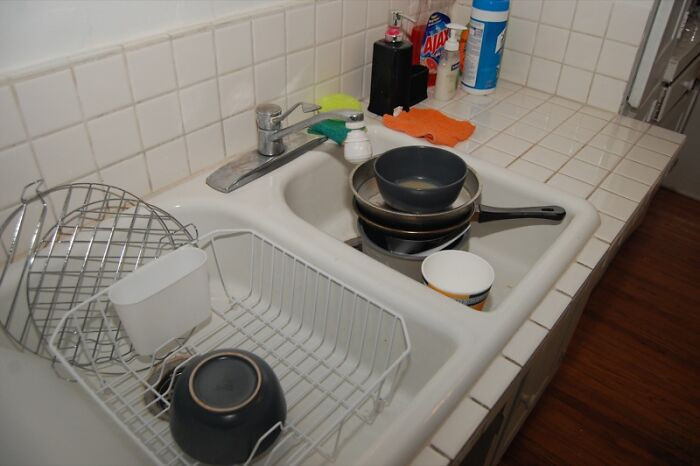
The width and height of the screenshot is (700, 466). In order to click on dish soap in this screenshot , I will do `click(433, 51)`.